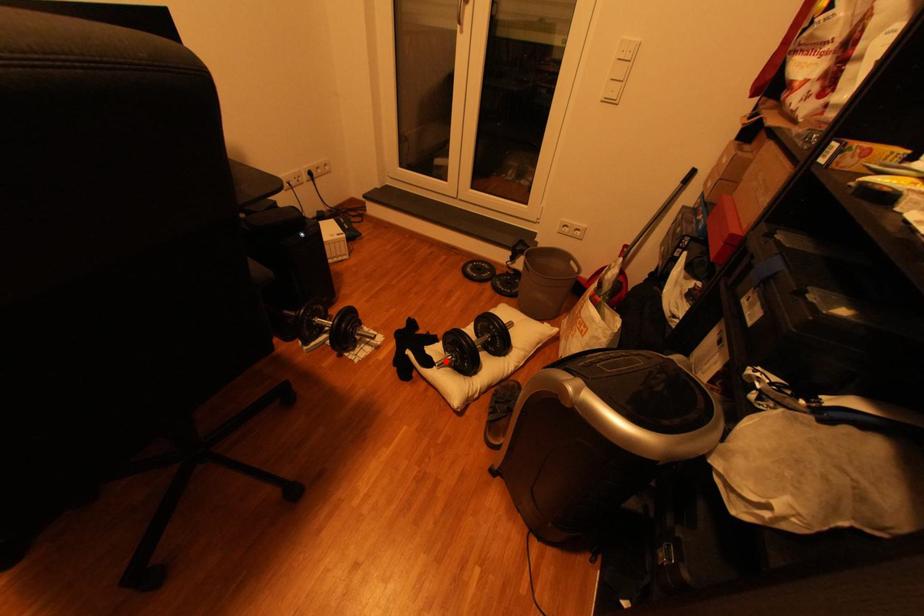
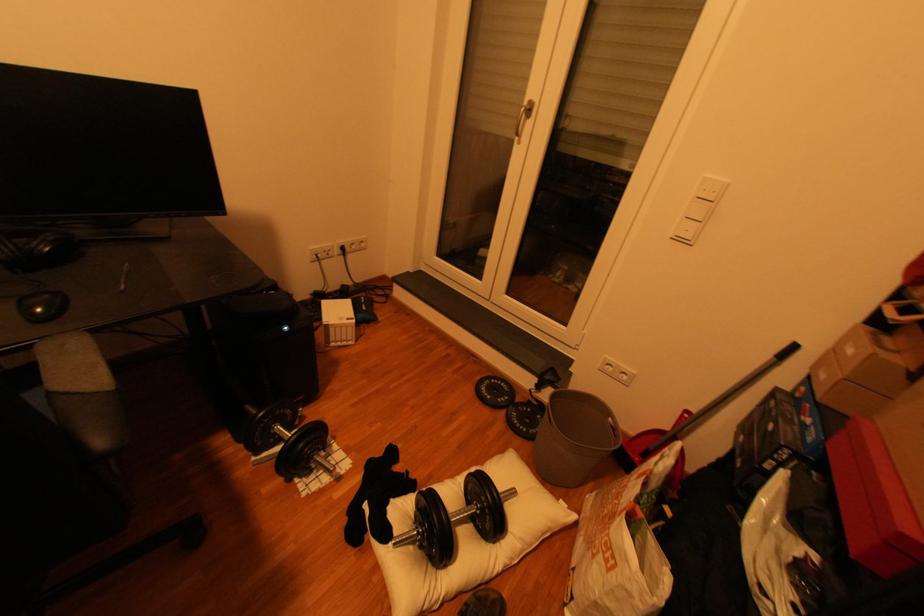
Where in the second image is the point corresponding to the highlighted location from the first image?

(406, 533)